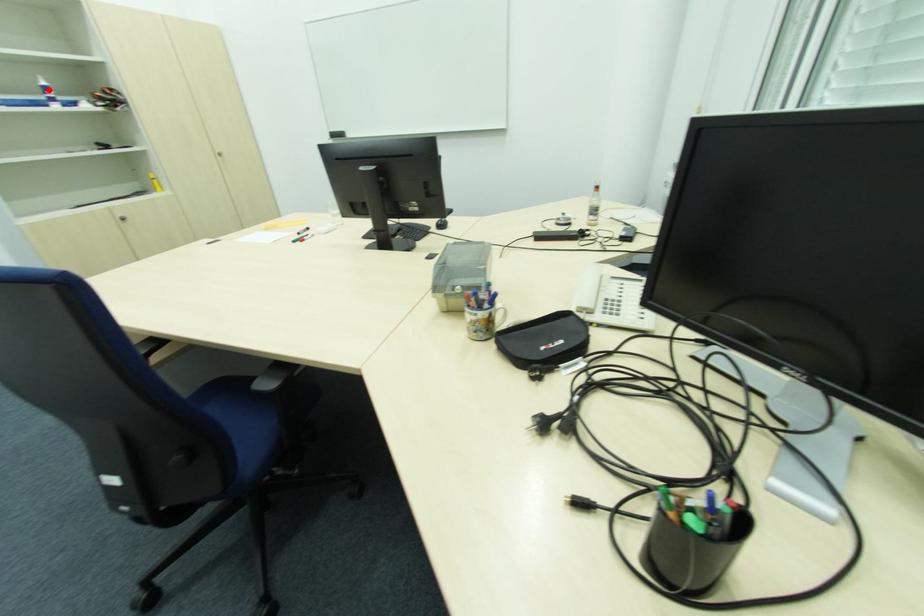
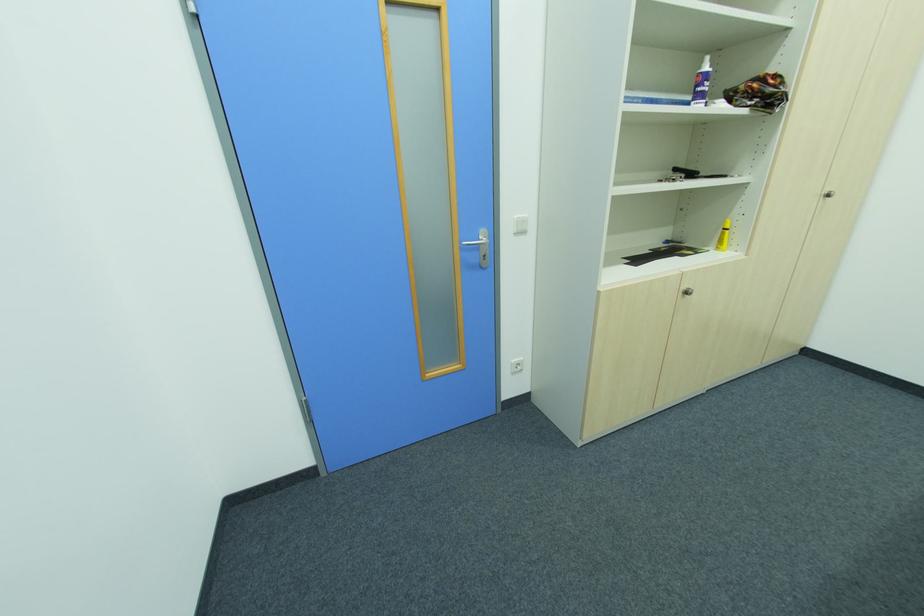
Question: A red point is marked in image1. In image2, is the corresponding 3D point closer to the camera or farther? Reply with the corresponding letter.

Choices:
 (A) The corresponding 3D point is closer.
 (B) The corresponding 3D point is farther.

Answer: (A)